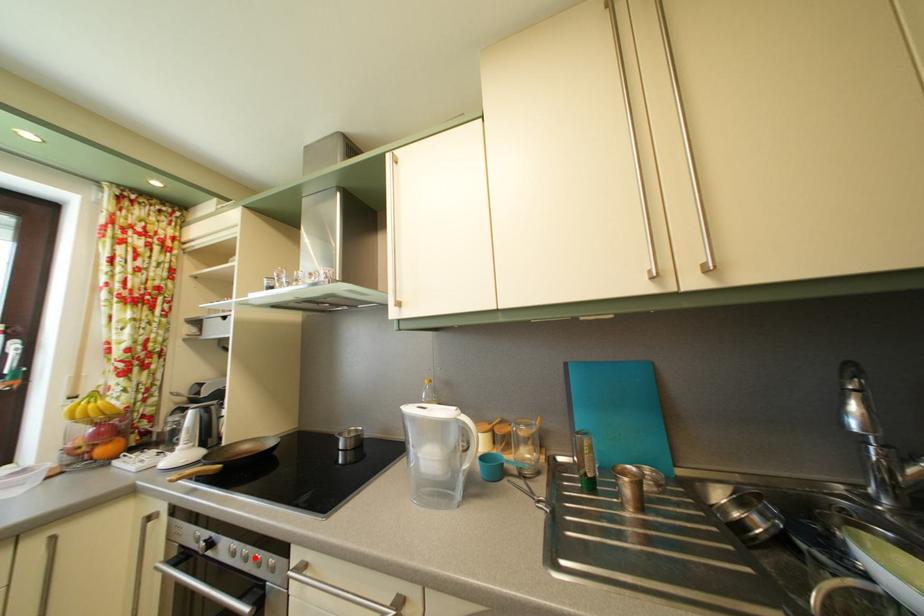
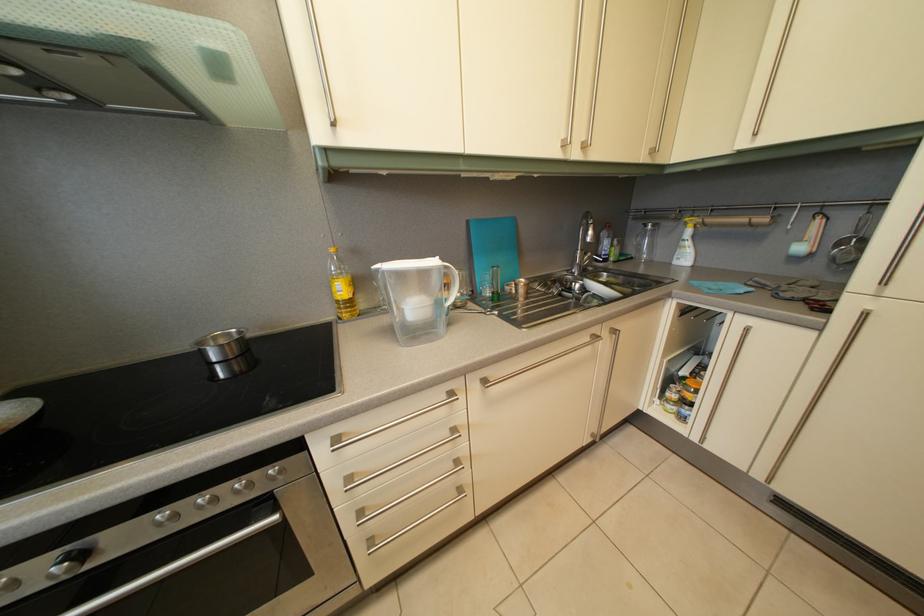
Where in the second image is the point corresponding to the highlighted location from the first image?

(211, 505)